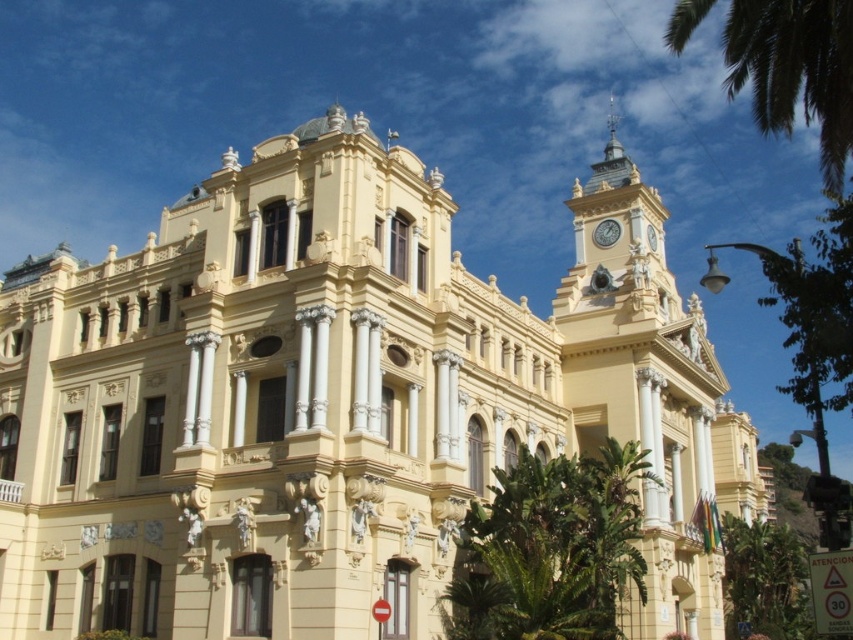
Based on the photo, is green leafy palm tree at lower right thinner than metallic clock at upper right?

No.

Image resolution: width=853 pixels, height=640 pixels. I want to click on green leafy palm tree at lower right, so click(x=764, y=580).

This screenshot has width=853, height=640. In order to click on green leafy palm tree at lower right in this screenshot , I will do `click(764, 580)`.

Can you confirm if green leafy palm tree at upper right is taller than green leafy palm tree at lower right?

Correct, green leafy palm tree at upper right is much taller as green leafy palm tree at lower right.

Can you confirm if green leafy palm tree at upper right is bigger than green leafy palm tree at lower right?

Yes, green leafy palm tree at upper right is bigger than green leafy palm tree at lower right.

At what (x,y) coordinates should I click in order to perform the action: click on green leafy palm tree at upper right. Please return your answer as a coordinate pair (x, y). This screenshot has width=853, height=640. Looking at the image, I should click on tap(795, 70).

Find the location of `green leafy palm tree at upper right`. green leafy palm tree at upper right is located at coordinates (795, 70).

Does green leafy palm tree at upper right have a lesser height compared to metallic clock at upper right?

Incorrect, green leafy palm tree at upper right's height does not fall short of metallic clock at upper right's.

Who is positioned more to the right, green leafy palm tree at upper right or metallic clock at upper right?

green leafy palm tree at upper right

Between point (822, 145) and point (614, 241), which one is positioned in front?

Point (822, 145) is in front.

Where is `green leafy palm tree at upper right`? green leafy palm tree at upper right is located at coordinates (795, 70).